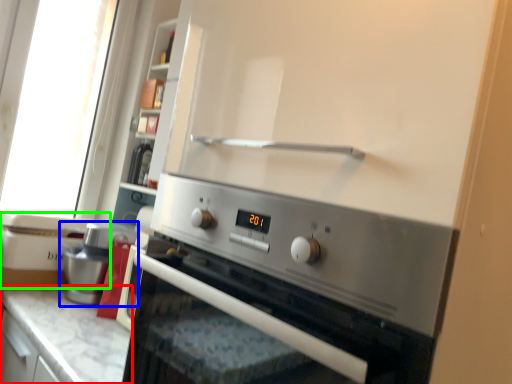
Question: Based on their relative distances, which object is farther from countertop (highlighted by a red box)? Choose from coffee machine (highlighted by a blue box) and appliance (highlighted by a green box).

Choices:
 (A) coffee machine
 (B) appliance

Answer: (B)